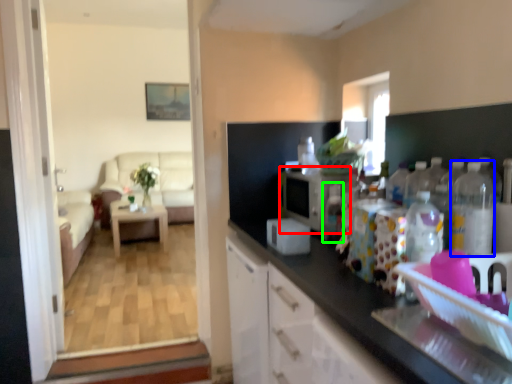
Question: Considering the real-world distances, which object is closest to appliance (highlighted by a red box)? bottle (highlighted by a blue box) or bottle (highlighted by a green box).

Choices:
 (A) bottle
 (B) bottle

Answer: (B)